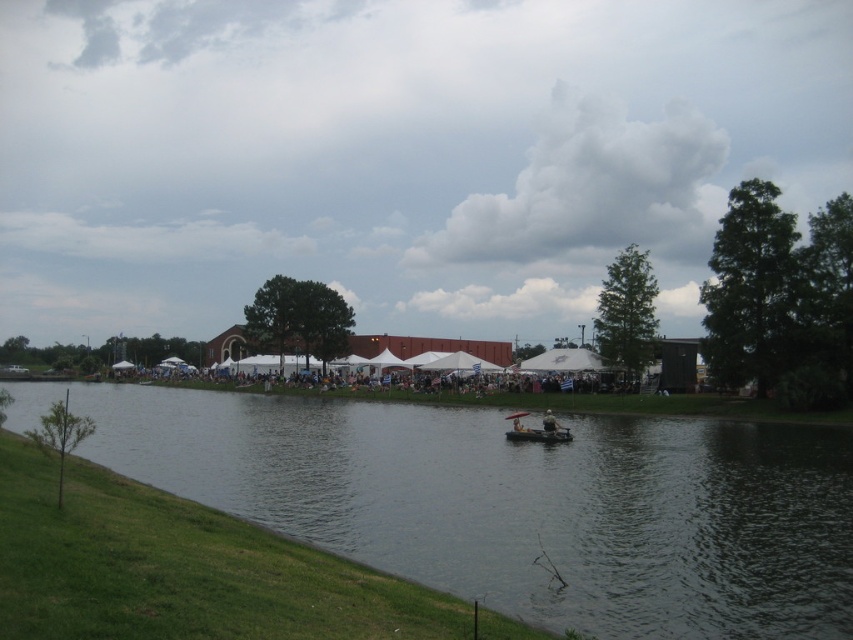
Question: Among these points, which one is farthest from the camera?

Choices:
 (A) (521, 413)
 (B) (717, 460)
 (C) (529, 433)
 (D) (552, 417)

Answer: (A)

Question: Can you confirm if clear water at center is positioned above wooden canoe at center?

Choices:
 (A) yes
 (B) no

Answer: (A)

Question: Is dark brown wooden canoe at center below light brown wooden bench at center?

Choices:
 (A) no
 (B) yes

Answer: (A)

Question: Does dark brown wooden canoe at center appear on the right side of light brown wooden bench at center?

Choices:
 (A) no
 (B) yes

Answer: (A)

Question: Among these points, which one is nearest to the camera?

Choices:
 (A) (740, 429)
 (B) (569, 440)

Answer: (B)

Question: Which object appears farthest from the camera in this image?

Choices:
 (A) wooden canoe at center
 (B) light brown wooden bench at center

Answer: (B)